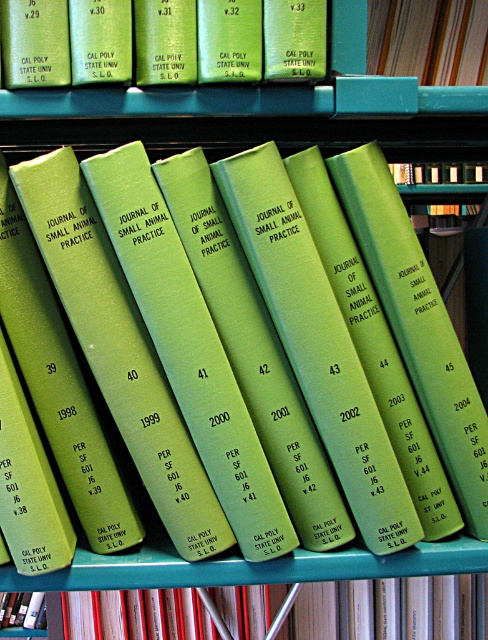
Describe the element at coordinates (435, 605) in the screenshot. I see `green matte book at center` at that location.

Is green matte book at center below green matte book at upper center?

Indeed, green matte book at center is positioned under green matte book at upper center.

Between point (411, 611) and point (441, 10), which one is positioned behind?

Point (411, 611)

The height and width of the screenshot is (640, 488). I want to click on green matte book at center, so click(x=435, y=605).

Is matte green book at center thinner than green matte book at center?

Correct, matte green book at center's width is less than green matte book at center's.

Consider the image. Which of these two, matte green book at center or green matte book at center, stands taller?

Standing taller between the two is green matte book at center.

The width and height of the screenshot is (488, 640). Find the location of `matte green book at center`. matte green book at center is located at coordinates (162, 42).

Who is lower down, matte green book at center or green matte book at upper center?

Positioned lower is matte green book at center.

Is matte green book at center shorter than green matte book at upper center?

Yes.

Measure the distance between matte green book at center and camera.

A distance of 18.18 inches exists between matte green book at center and camera.

Where is `matte green book at center`? The image size is (488, 640). matte green book at center is located at coordinates (162, 42).